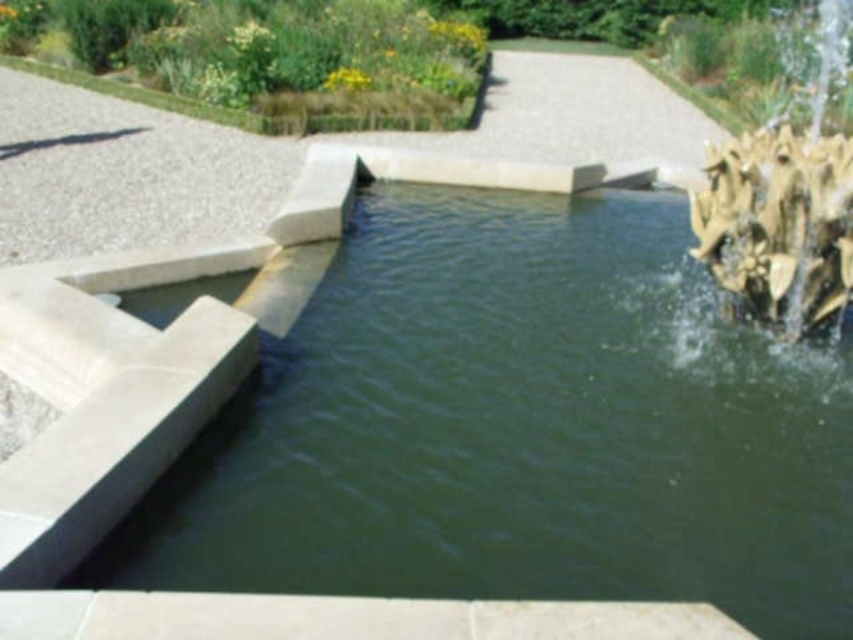
Question: Is green stone pool at center thinner than green grass at upper left?

Choices:
 (A) yes
 (B) no

Answer: (A)

Question: Which object appears farthest from the camera in this image?

Choices:
 (A) green stone pool at center
 (B) gold textured sculpture at right
 (C) green grass at upper left

Answer: (C)

Question: Which is nearer to the green grass at upper left?

Choices:
 (A) gold textured sculpture at right
 (B) green stone pool at center

Answer: (A)

Question: Is green grass at upper left in front of gold textured sculpture at right?

Choices:
 (A) yes
 (B) no

Answer: (B)

Question: Which object appears farthest from the camera in this image?

Choices:
 (A) gold textured sculpture at right
 (B) green grass at upper left

Answer: (B)

Question: Does green stone pool at center have a larger size compared to gold textured sculpture at right?

Choices:
 (A) yes
 (B) no

Answer: (B)